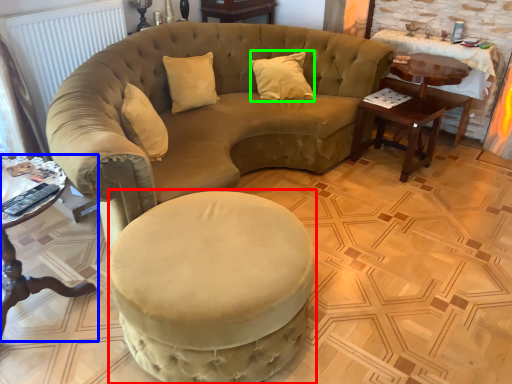
Question: Considering the real-world distances, which object is closest to swivel chair (highlighted by a red box)? table (highlighted by a blue box) or pillow (highlighted by a green box).

Choices:
 (A) table
 (B) pillow

Answer: (A)